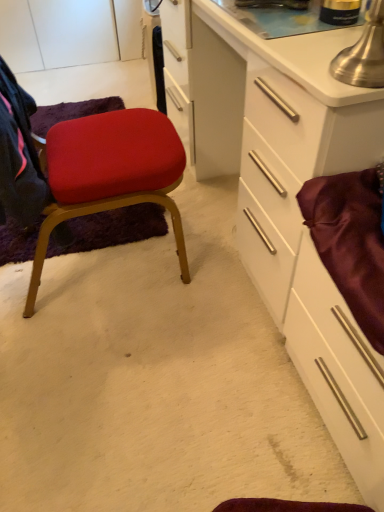
Image resolution: width=384 pixels, height=512 pixels. Find the location of `free location to the left of metallic silver table lamp at upper right`. free location to the left of metallic silver table lamp at upper right is located at coordinates (300, 66).